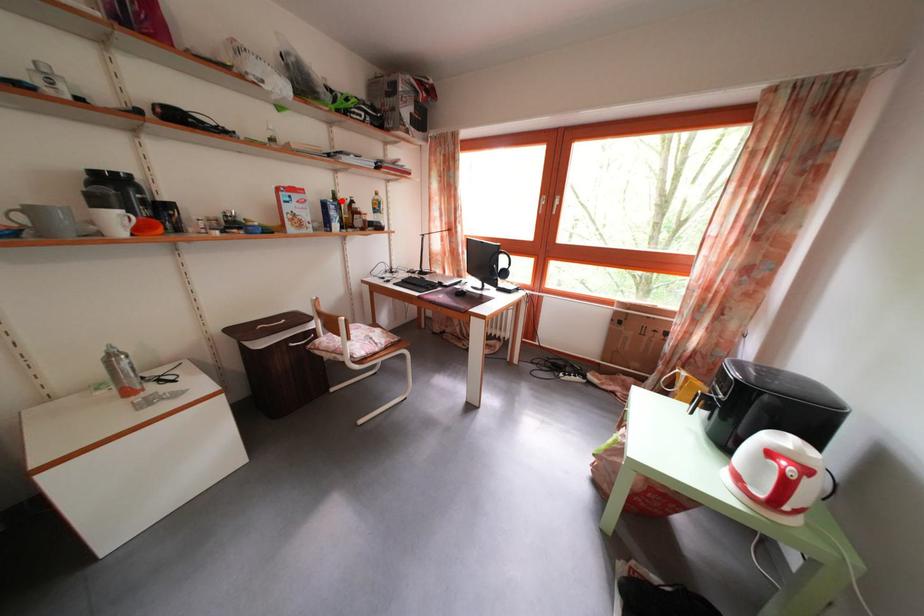
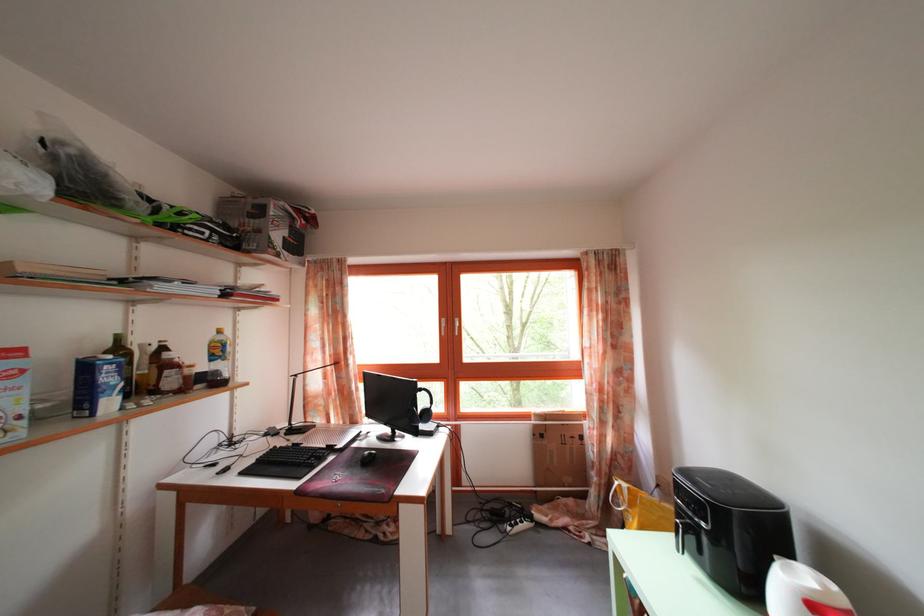
Question: I am providing you with two images of the same scene from different viewpoints. Image1 has a red point marked. In image2, the corresponding 3D location appears at what relative position? Reply with the corresponding letter.

Choices:
 (A) Closer
 (B) Farther

Answer: (B)